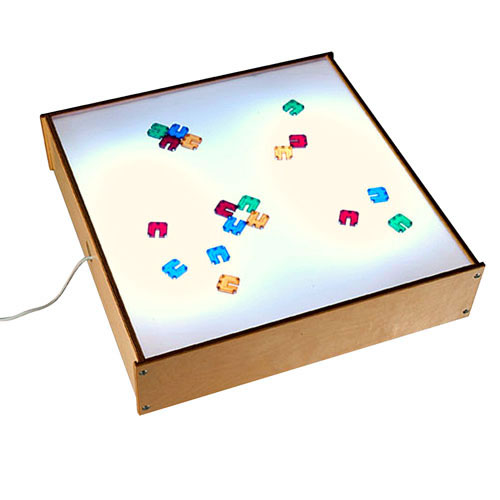
Identify the location of yellow play tile. (226, 285), (263, 223), (285, 149), (186, 144).